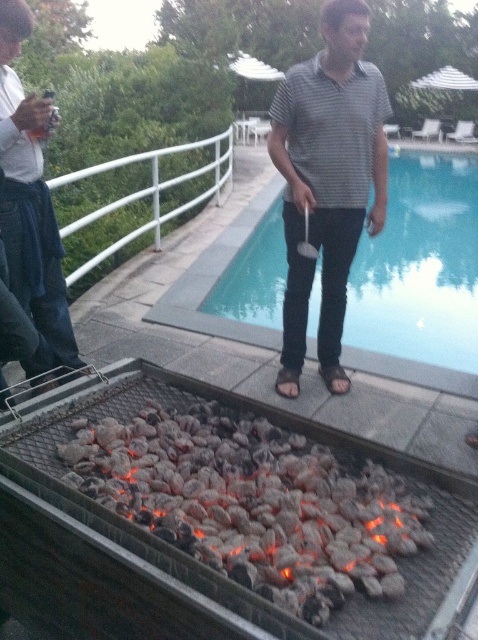
You are planning to move the charcoal at lower center to the right side of the gray striped shirt at center. Is there enough space between them to do this?

The charcoal at lower center is currently positioned on the left side of gray striped shirt at center. Since you want to move it to the right side, you need to check if there is enough space between them. However, the description does not provide information about the distance or available space between the two objects. Therefore, it is unclear if there is sufficient space to perform this action.

You are planning to place a small decorative statue on the edge of the blue glass swimming pool at center. Considering the size of the brushed metal water at bottle left, will there be enough space on the pool edge to accommodate the statue?

The blue glass swimming pool at center is larger in size than the brushed metal water at bottle left, so there should be sufficient space on the pool edge to place the statue.